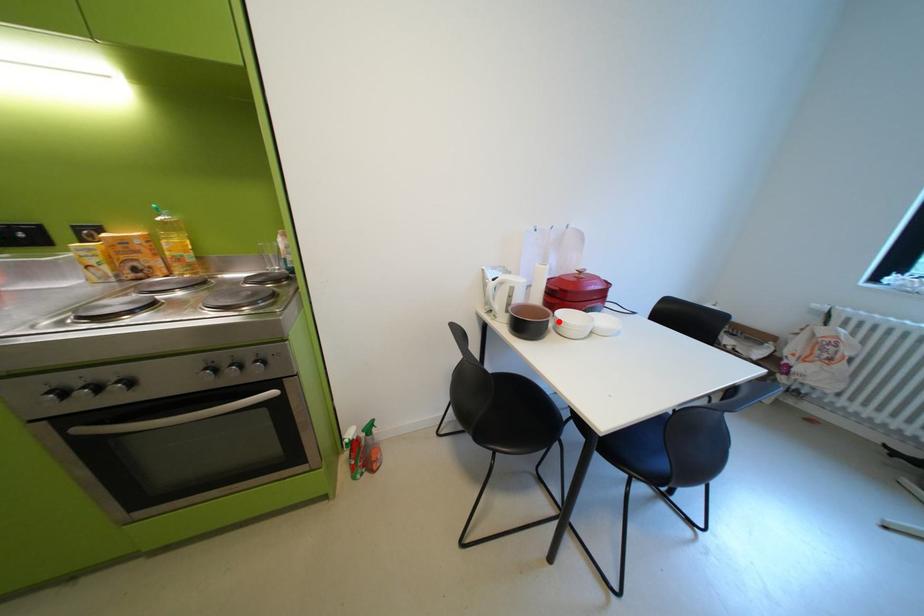
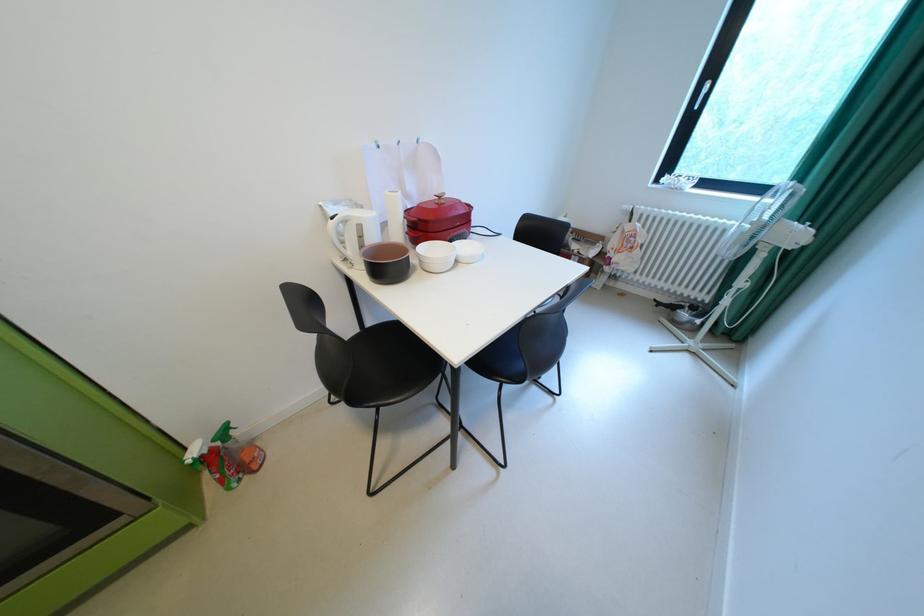
In the second image, find the point that corresponds to the highlighted location in the first image.

(419, 259)